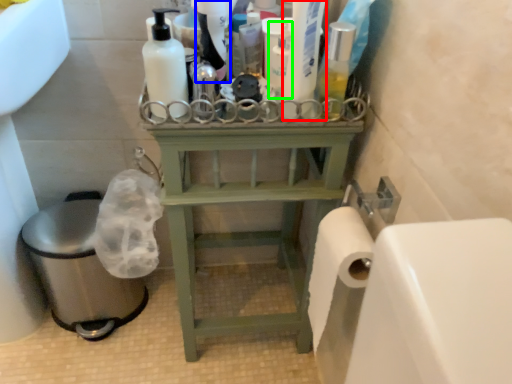
Question: Based on their relative distances, which object is farther from cleaning product (highlighted by a red box)? Choose from cleaning product (highlighted by a blue box) and cleaning product (highlighted by a green box).

Choices:
 (A) cleaning product
 (B) cleaning product

Answer: (A)